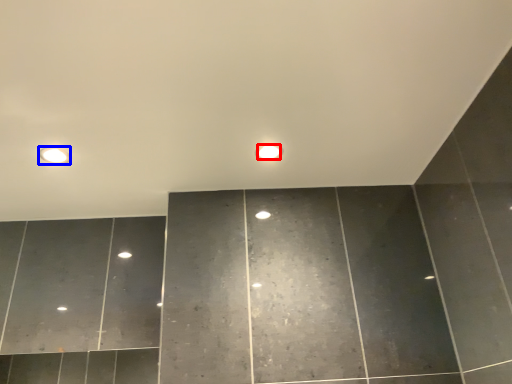
Question: Which object appears farthest to the camera in this image, light bulb (highlighted by a red box) or fixture (highlighted by a blue box)?

Choices:
 (A) light bulb
 (B) fixture

Answer: (A)